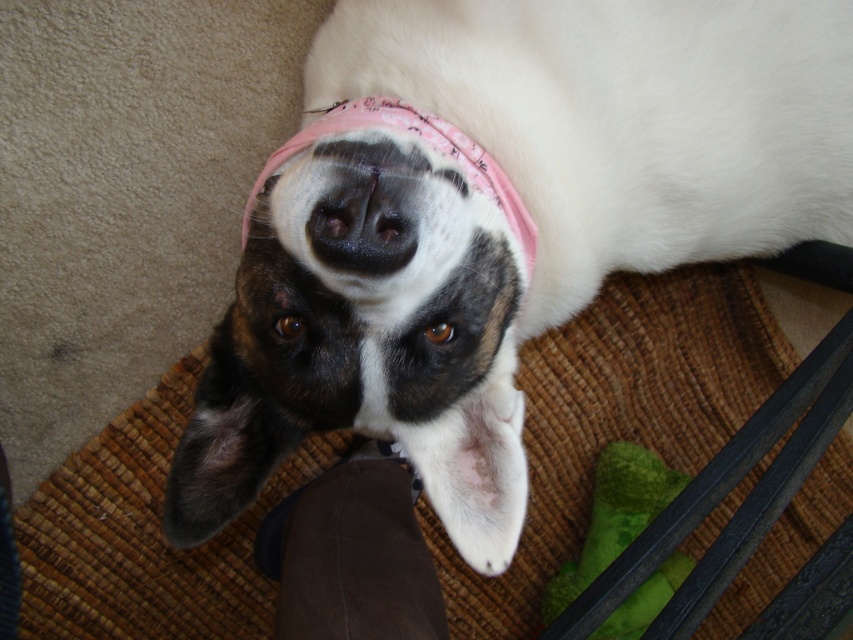
You are a dog owner who wants to fetch the green rubber bone at lower right. From the dog lying on the cushion, which direction should you move the bone to so it is closer to the black smooth nose at center?

The green rubber bone at lower right is below the black smooth nose at center. To move it closer, you should move the bone upward towards the nose.

Consider the image. You are a dog owner who wants to place a new toy, a red rubber ball, in the image. The existing green rubber bone at lower right is located at point coordinates [613,516]. If you want to place the new toy so that it is to the left of the green rubber bone at lower right, what coordinate x value should be less than 0.808?

To place the red rubber ball to the left of the green rubber bone at lower right, the x coordinate should be less than 0.808.

You are a dog owner who wants to place a new toy in the image. The existing toys are located at point (613, 516). Where should you place the new toy so it is not too close to the existing toys?

The existing green rubber bone at lower right is located at point (613, 516), so placing the new toy away from this point would ensure it is not too close.